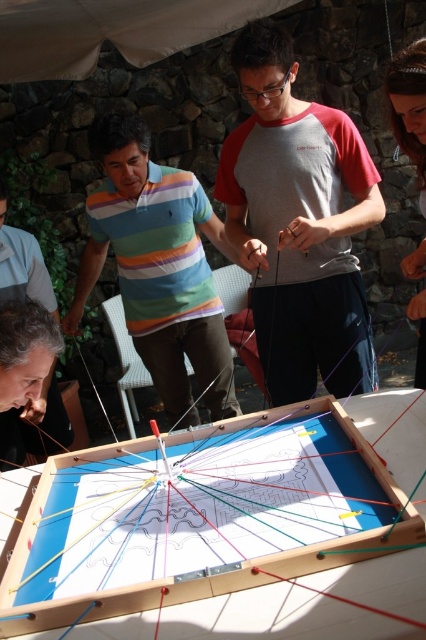
In the scene shown: Which is more to the right, striped cotton shirt at center or striped cotton shirt at lower left?

Positioned to the right is striped cotton shirt at center.

Can you confirm if striped cotton shirt at center is positioned to the left of striped cotton shirt at lower left?

In fact, striped cotton shirt at center is to the right of striped cotton shirt at lower left.

Is point (134, 141) more distant than point (17, 429)?

No.

I want to click on striped cotton shirt at center, so click(x=158, y=268).

Is point (317, 262) more distant than point (94, 241)?

No, it is not.

Does gray/red cotton shirt at center lie behind striped cotton shirt at center?

No.

In order to click on gray/red cotton shirt at center in this screenshot , I will do `click(299, 224)`.

Who is more forward, [334,209] or [28,408]?

Positioned in front is point [28,408].

Which is above, gray/red cotton shirt at center or striped cotton shirt at lower left?

gray/red cotton shirt at center

Between point (305, 266) and point (17, 241), which one is positioned in front?

Point (305, 266) is more forward.

Find the location of `gray/red cotton shirt at center`. gray/red cotton shirt at center is located at coordinates (299, 224).